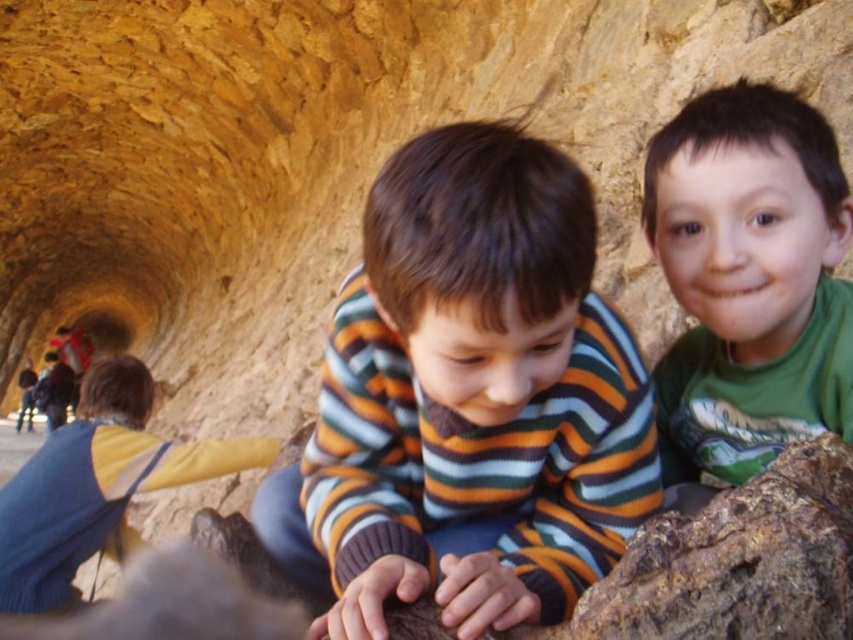
Question: Is striped sweater at center bigger than green matte shirt at upper right?

Choices:
 (A) no
 (B) yes

Answer: (B)

Question: Among these points, which one is farthest from the camera?

Choices:
 (A) (700, 429)
 (B) (367, 234)

Answer: (A)

Question: Is striped sweater at center to the right of green matte shirt at upper right from the viewer's perspective?

Choices:
 (A) no
 (B) yes

Answer: (A)

Question: Does striped sweater at center appear under green matte shirt at upper right?

Choices:
 (A) no
 (B) yes

Answer: (B)